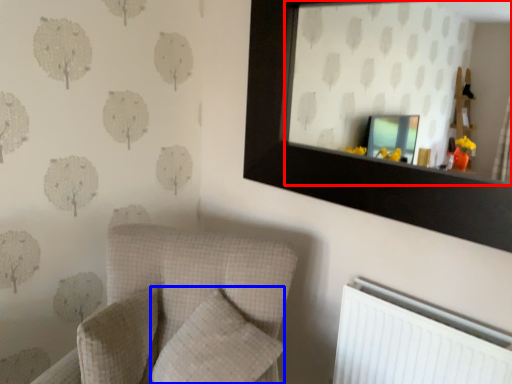
Question: Which of the following is the farthest to the observer, mirror (highlighted by a red box) or pillow (highlighted by a blue box)?

Choices:
 (A) mirror
 (B) pillow

Answer: (B)